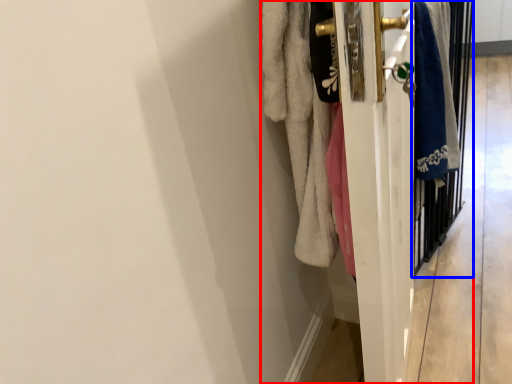
Question: Which of the following is the closest to the observer, closet (highlighted by a red box) or screen door (highlighted by a blue box)?

Choices:
 (A) closet
 (B) screen door

Answer: (A)